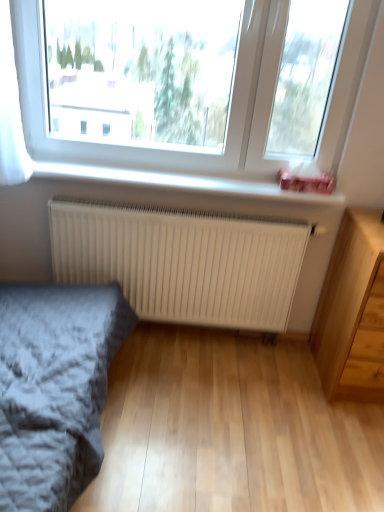
Where is `free area below transparent glass window at upper center (from a real-world perspective)`? free area below transparent glass window at upper center (from a real-world perspective) is located at coordinates (211, 176).